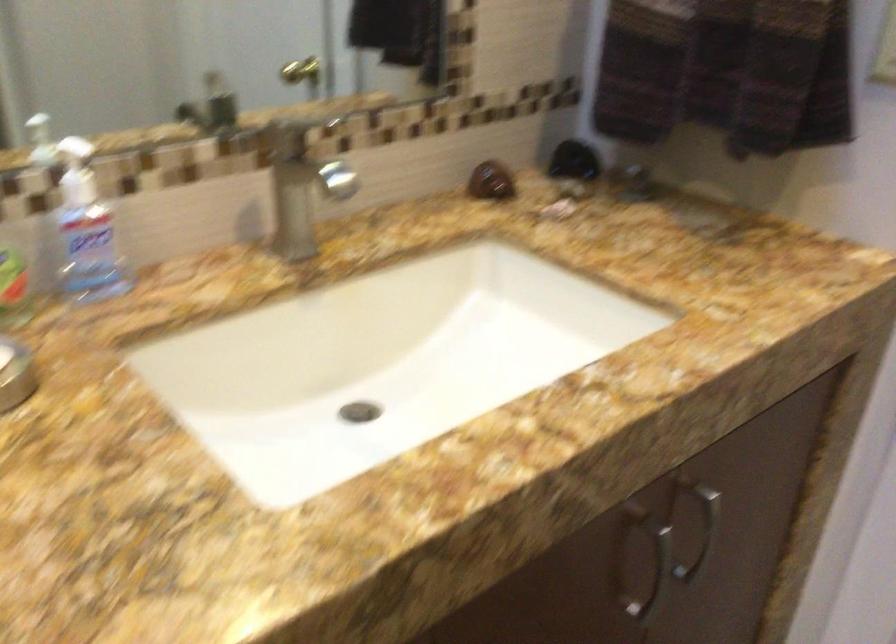
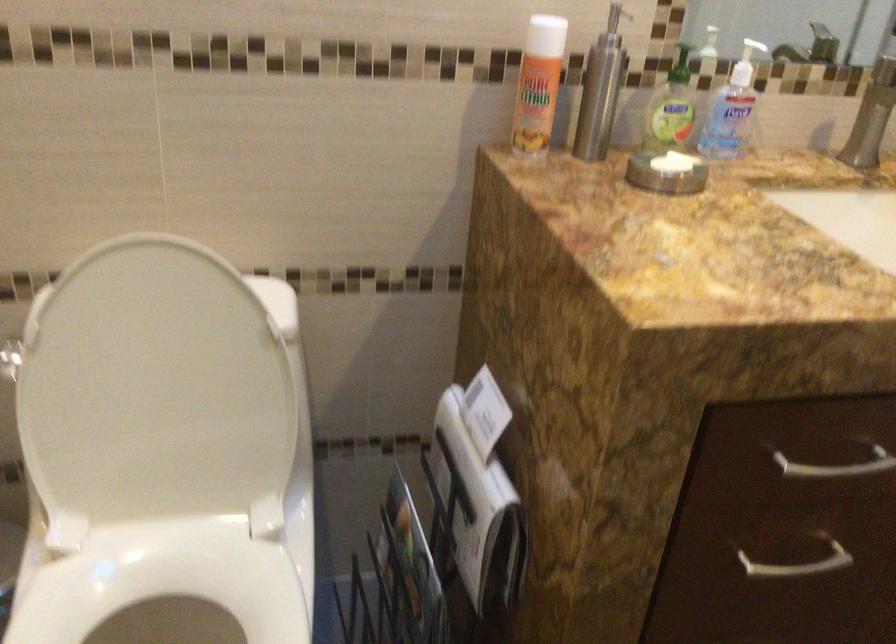
Locate, in the second image, the point that corresponds to pixel 83 171 in the first image.

(745, 64)